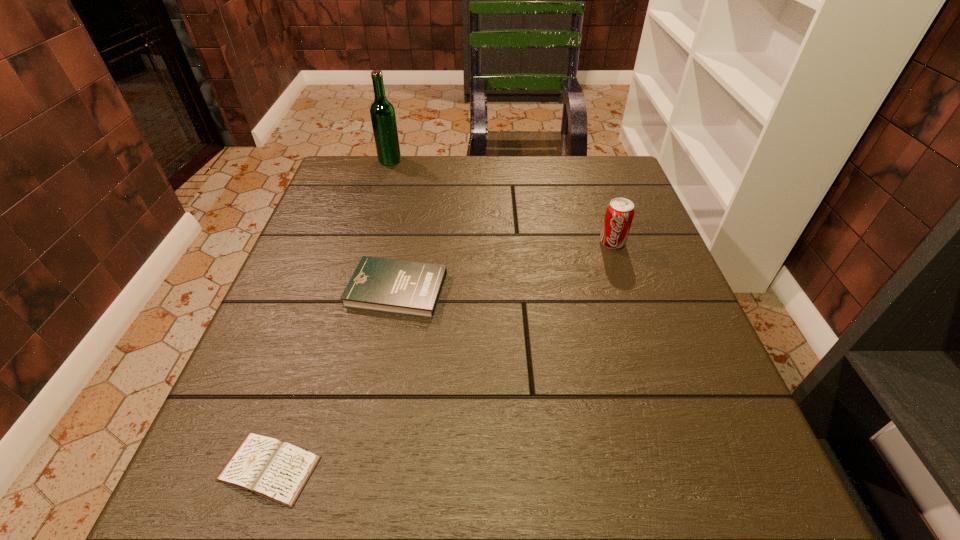
Image resolution: width=960 pixels, height=540 pixels. Find the location of `vacant point that satisfies the following two spatial constraints: 1. on the back side of the shortest object; 2. on the right side of the tallest object`. vacant point that satisfies the following two spatial constraints: 1. on the back side of the shortest object; 2. on the right side of the tallest object is located at coordinates (374, 160).

Identify the location of free spot that satisfies the following two spatial constraints: 1. on the back side of the second farthest object; 2. on the right side of the nearest object. (347, 242).